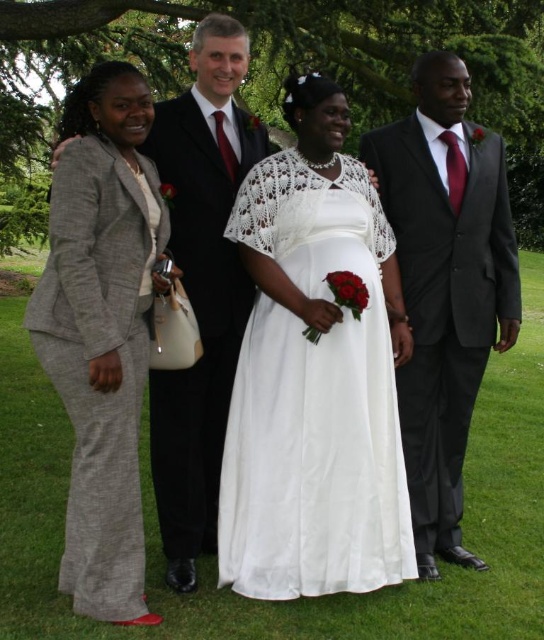
In the scene shown: You are a photographer setting up for a group photo. You need to arrange the gray wool suit at left and the matte black suit at right so that both are visible in the frame. Considering their heights, which suit should be positioned closer to the front to ensure both are fully visible?

The gray wool suit at left is shorter than the matte black suit at right, so placing the gray wool suit at left slightly forward will ensure both are fully visible in the frame.

You are a photographer trying to position a decorative arch for a wedding photo. The arch needs to be placed at the exact center of the image. However, you must ensure that it does not overlap with the white satin dress at center. Is the arch currently positioned correctly?

The white satin dress at center is located at point [313,400], which is not the exact center of the image. The exact center would be at point [272,320]. Therefore, the arch is not positioned correctly and needs adjustment to avoid overlapping.

You are a photographer at a wedding and need to arrange the two guests wearing the gray wool suit at left and the matte black suit at right for a group photo. The director wants them to stand in reverse order of their current positions. Which guest should move to the right side?

The gray wool suit at left is positioned on the left side of matte black suit at right. To reverse their positions, the gray wool suit at left should move to the right side.